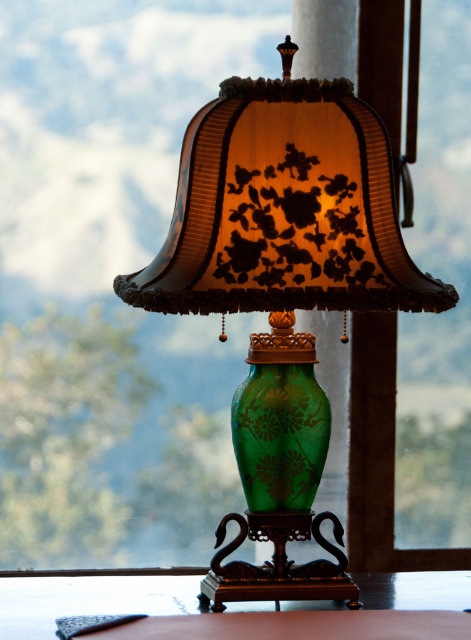
Who is taller, green glass vase at center or green glass table at center?

green glass vase at center is taller.

Is green glass vase at center closer to camera compared to green glass table at center?

Yes.

The image size is (471, 640). Find the location of `green glass vase at center`. green glass vase at center is located at coordinates (283, 291).